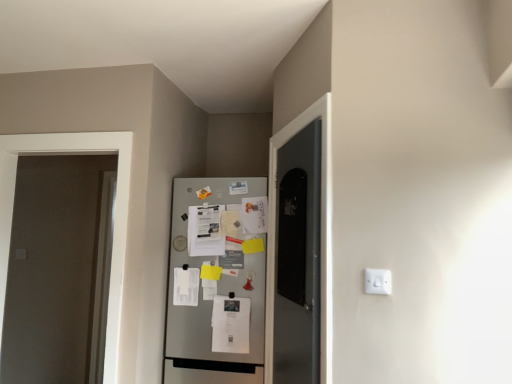
Question: In terms of height, does white plastic electric outlet at center right look taller or shorter compared to metallic silver refrigerator at center?

Choices:
 (A) tall
 (B) short

Answer: (B)

Question: Considering the positions of point pos(391,279) and point pos(216,322), is point pos(391,279) closer or farther from the camera than point pos(216,322)?

Choices:
 (A) closer
 (B) farther

Answer: (A)

Question: Based on their relative distances, which object is farther from the white matte door at left?

Choices:
 (A) white plastic electric outlet at center right
 (B) metallic silver refrigerator at center

Answer: (A)

Question: Considering the real-world distances, which object is closest to the white matte door at left?

Choices:
 (A) white plastic electric outlet at center right
 (B) metallic silver refrigerator at center

Answer: (B)